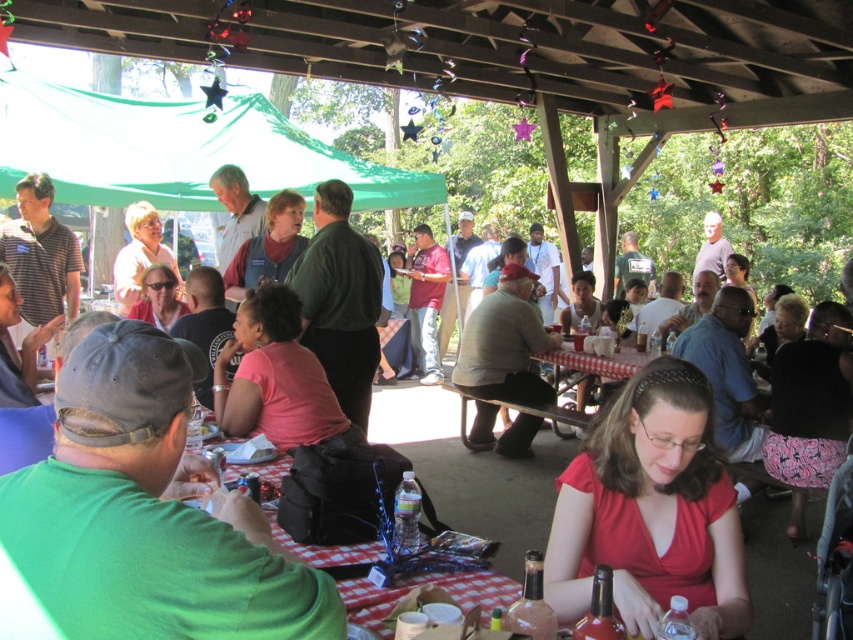
Which is below, matte red blouse at center or pink fabric shirt at center?

matte red blouse at center is lower down.

How distant is matte red blouse at center from pink fabric shirt at center?

They are 4.19 feet apart.

Looking at this image, who is more forward, [628,387] or [252,394]?

Point [628,387] is more forward.

Image resolution: width=853 pixels, height=640 pixels. I want to click on matte red blouse at center, so (651, 509).

Based on the photo, can you confirm if pink fabric shirt at center is taller than red checkered tablecloth at center?

Indeed, pink fabric shirt at center has a greater height compared to red checkered tablecloth at center.

I want to click on pink fabric shirt at center, so click(276, 376).

Which is more to the right, green matte shirt at center or pink fabric shirt at center?

From the viewer's perspective, green matte shirt at center appears more on the right side.

Does green matte shirt at center have a greater height compared to pink fabric shirt at center?

No.

Where is `green matte shirt at center`? This screenshot has width=853, height=640. green matte shirt at center is located at coordinates click(x=148, y=513).